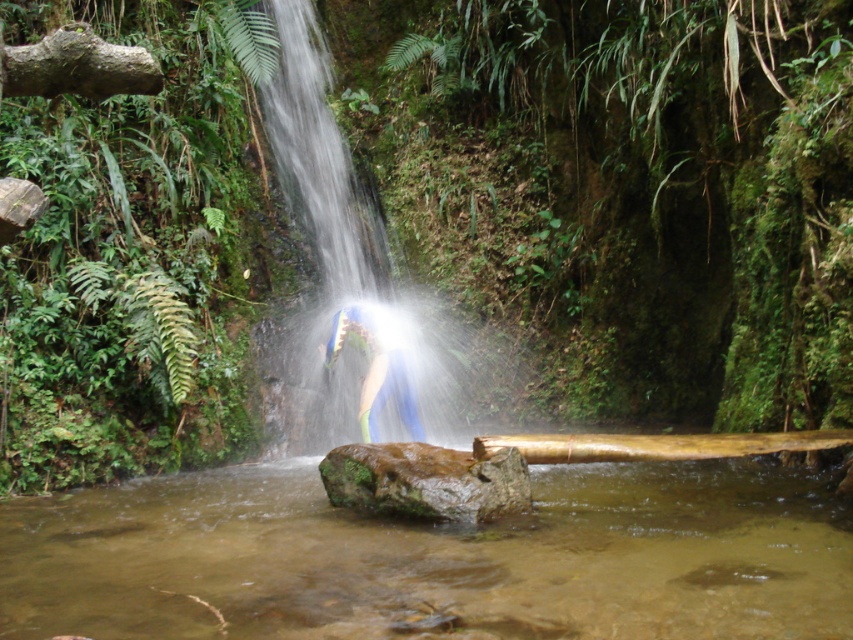
Question: Is clear water stream at center above blue fabric at center?

Choices:
 (A) yes
 (B) no

Answer: (B)

Question: Which point appears farthest from the camera in this image?

Choices:
 (A) [x=440, y=483]
 (B) [x=343, y=310]
 (C) [x=279, y=612]

Answer: (B)

Question: Which object is farther from the camera taking this photo?

Choices:
 (A) blue fabric at center
 (B) green mossy rock at center
 (C) translucent water at center
 (D) clear water stream at center

Answer: (C)

Question: Is clear water stream at center below blue fabric at center?

Choices:
 (A) yes
 (B) no

Answer: (A)

Question: Which point appears farthest from the camera in this image?

Choices:
 (A) (352, 499)
 (B) (802, 554)

Answer: (A)

Question: Can you confirm if clear water stream at center is thinner than blue fabric at center?

Choices:
 (A) no
 (B) yes

Answer: (A)